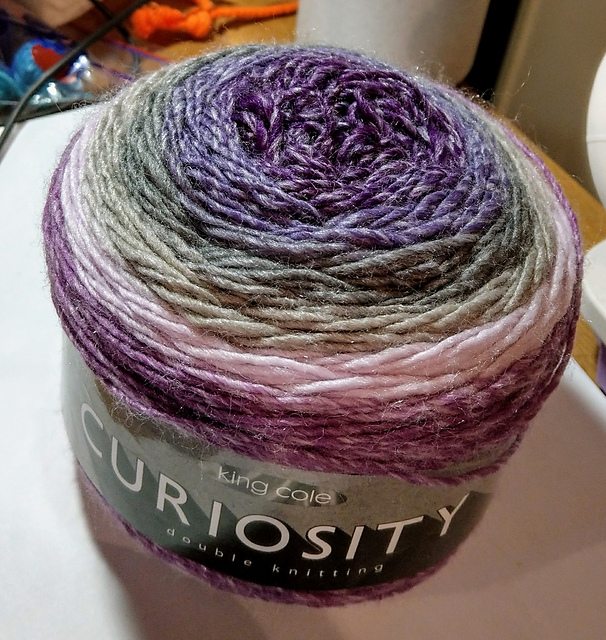
The image size is (606, 640). What are the coordinates of `blue and red toy` in the screenshot? It's located at (25, 61).